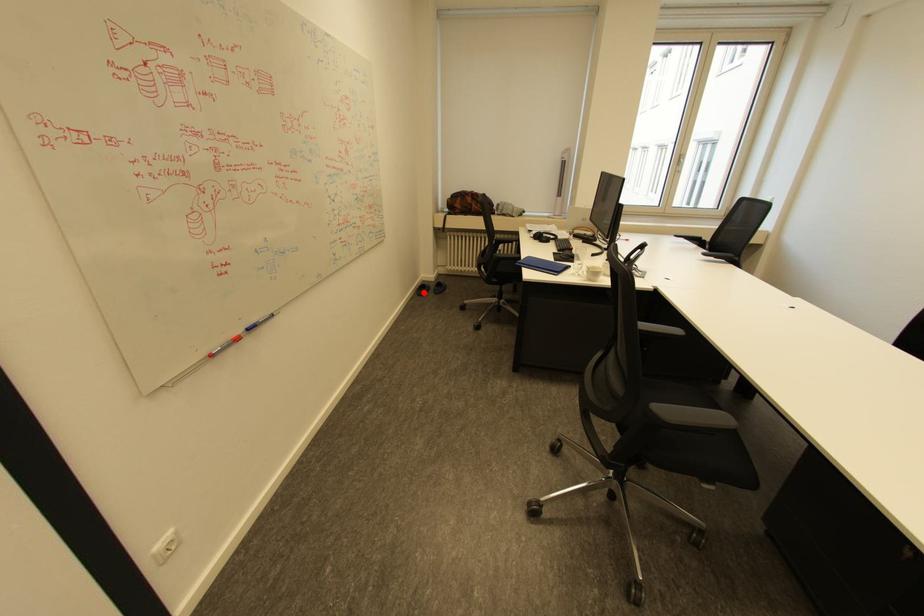
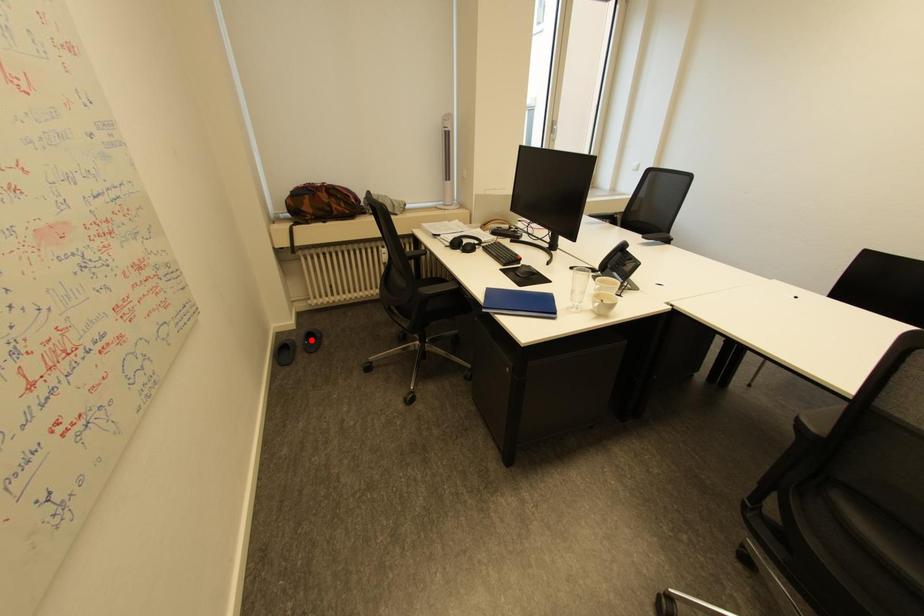
I am providing you with two images of the same scene from different viewpoints. A red point is marked on the first image and another point is marked on the second image. Do the highlighted points in image1 and image2 indicate the same real-world spot?

No